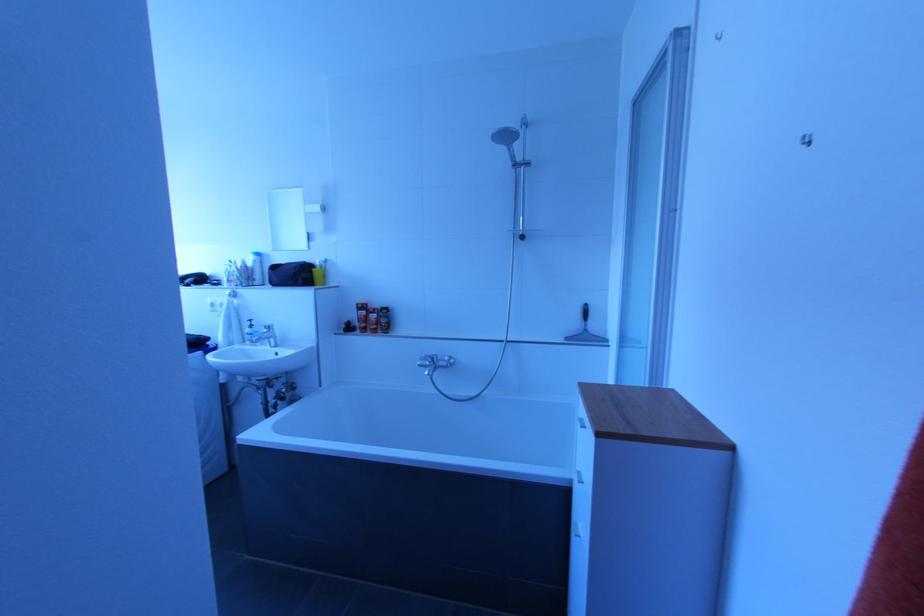
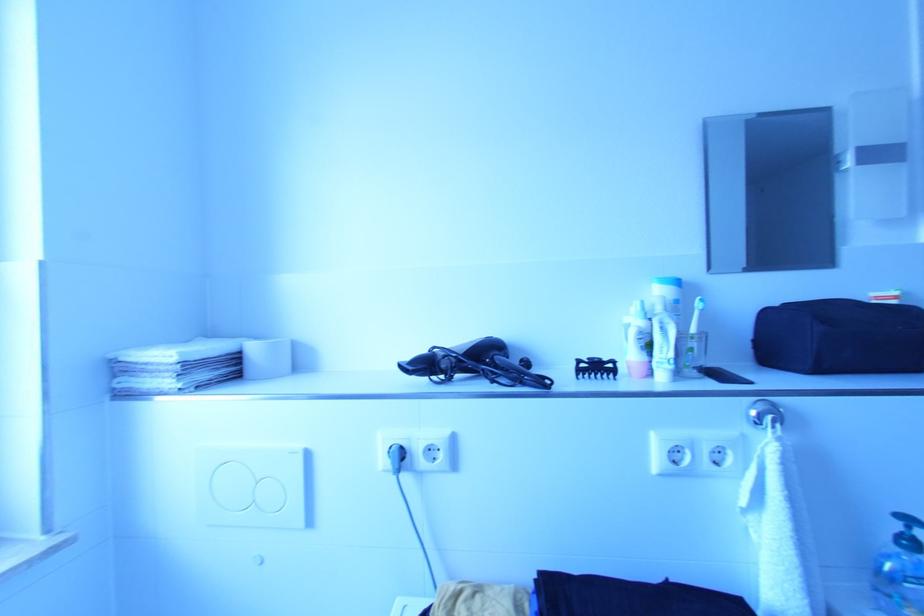
What movement of the cameraman would produce the second image?

The cameraman walked toward left, forward.